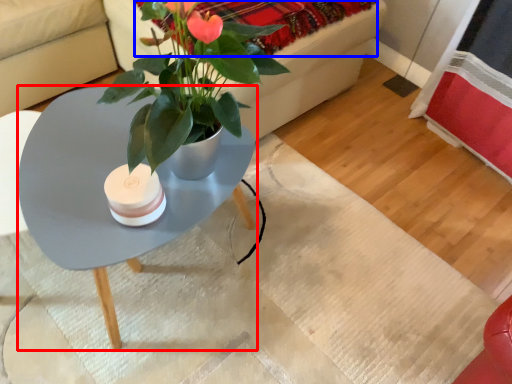
Question: Which object appears closest to the camera in this image, coffee table (highlighted by a red box) or blanket (highlighted by a blue box)?

Choices:
 (A) coffee table
 (B) blanket

Answer: (A)